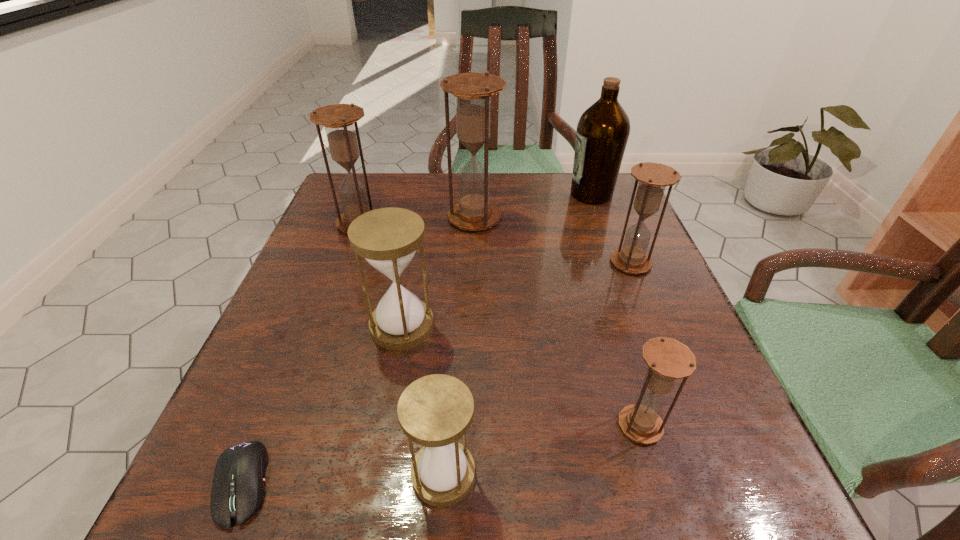
This screenshot has width=960, height=540. I want to click on the fourth closest hourglass relative to the third smallest brown hourglass, so click(x=434, y=411).

Select which hourglass is the closest to the rightmost hourglass. Please provide its 2D coordinates. Your answer should be formatted as a tuple, i.e. [(x, y)], where the tuple contains the x and y coordinates of a point satisfying the conditions above.

[(472, 91)]

Select which brown hourglass appears as the closest to the brown olive oil. Please provide its 2D coordinates. Your answer should be formatted as a tuple, i.e. [(x, y)], where the tuple contains the x and y coordinates of a point satisfying the conditions above.

[(472, 91)]

Locate which brown hourglass ranks in proximity to the fourth farthest object. Please provide its 2D coordinates. Your answer should be formatted as a tuple, i.e. [(x, y)], where the tuple contains the x and y coordinates of a point satisfying the conditions above.

[(472, 91)]

This screenshot has width=960, height=540. What are the coordinates of `vacant region that satisfies the following two spatial constraints: 1. on the label of the brown olive oil; 2. on the front side of the shortest object` in the screenshot? It's located at (698, 483).

This screenshot has width=960, height=540. What are the coordinates of `blank space that satisfies the following two spatial constraints: 1. on the label of the olive oil; 2. on the front side of the black computer equipment` in the screenshot? It's located at (698, 483).